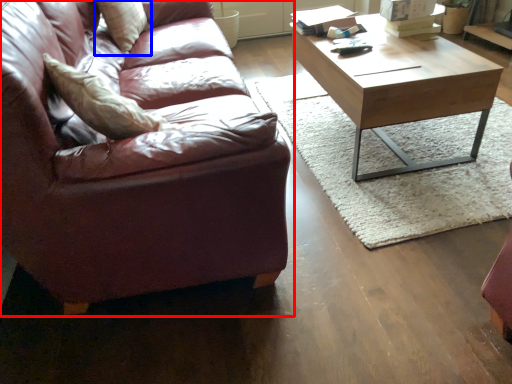
Question: Which of the following is the closest to the observer, studio couch (highlighted by a red box) or pillow (highlighted by a blue box)?

Choices:
 (A) studio couch
 (B) pillow

Answer: (A)